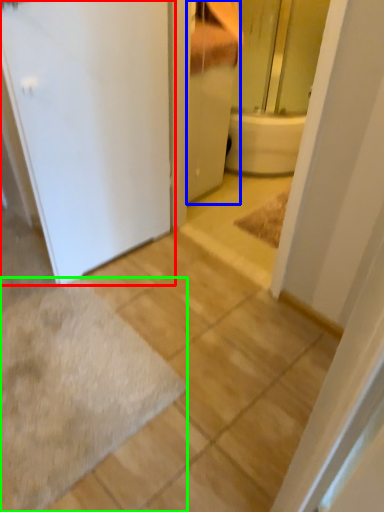
Question: Estimate the real-world distances between objects in this image. Which object is closer to door (highlighted by a red box), bathroom cabinet (highlighted by a blue box) or bath mat (highlighted by a green box)?

Choices:
 (A) bathroom cabinet
 (B) bath mat

Answer: (A)